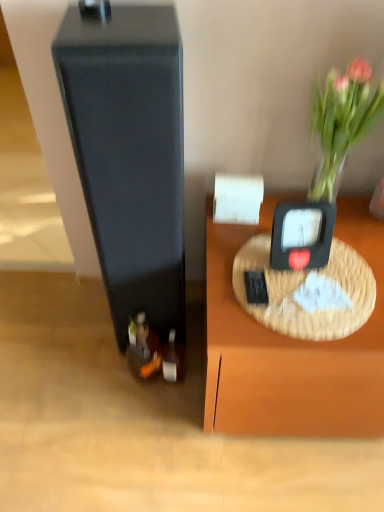
Where is `empty space that is to the right of shiny dark glass wine bottle at lower left, which is the 2th wine bottle from right to left`? This screenshot has width=384, height=512. empty space that is to the right of shiny dark glass wine bottle at lower left, which is the 2th wine bottle from right to left is located at coordinates (191, 382).